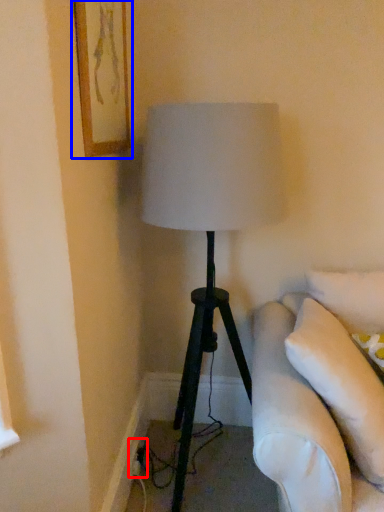
Question: Which point is closer to the camera, electric outlet (highlighted by a red box) or picture frame (highlighted by a blue box)?

Choices:
 (A) electric outlet
 (B) picture frame

Answer: (B)